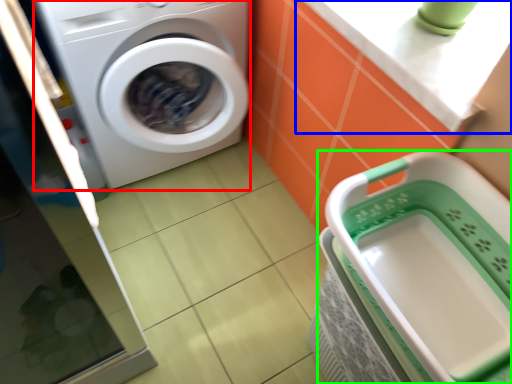
Question: Which is farther away from washing machine (highlighted by a red box)? counter top (highlighted by a blue box) or dish washer (highlighted by a green box)?

Choices:
 (A) counter top
 (B) dish washer

Answer: (B)